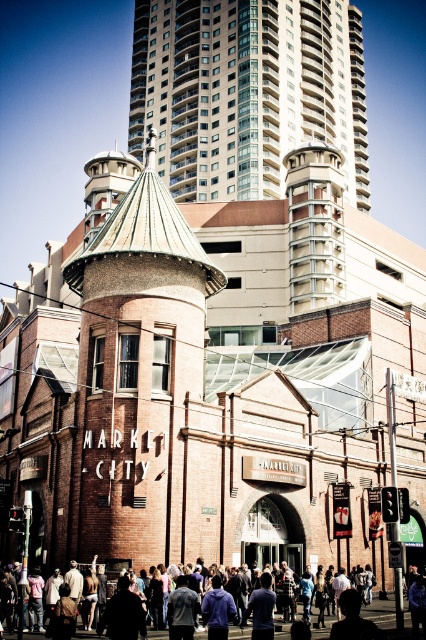
What do you see at coordinates (247, 92) in the screenshot? This screenshot has width=426, height=640. I see `white glass tower at upper center` at bounding box center [247, 92].

Who is shorter, white glass tower at upper center or dark blue shirt at center?

With less height is dark blue shirt at center.

Which is in front, point (299, 108) or point (391, 605)?

Point (391, 605) is in front.

The height and width of the screenshot is (640, 426). I want to click on white glass tower at upper center, so click(247, 92).

Can you confirm if brick tower at center is positioned to the right of dark blue shirt at center?

No, brick tower at center is not to the right of dark blue shirt at center.

Which is more to the right, brick tower at center or dark blue shirt at center?

Positioned to the right is dark blue shirt at center.

Is point (138, 180) farther from camera compared to point (402, 634)?

Yes, it is behind point (402, 634).

This screenshot has height=640, width=426. What are the coordinates of `brick tower at center` in the screenshot? It's located at (140, 380).

Which is above, brick tower at center or white glass tower at upper center?

white glass tower at upper center is above.

This screenshot has height=640, width=426. I want to click on brick tower at center, so click(x=140, y=380).

Locate an element on the screen. brick tower at center is located at coordinates pos(140,380).